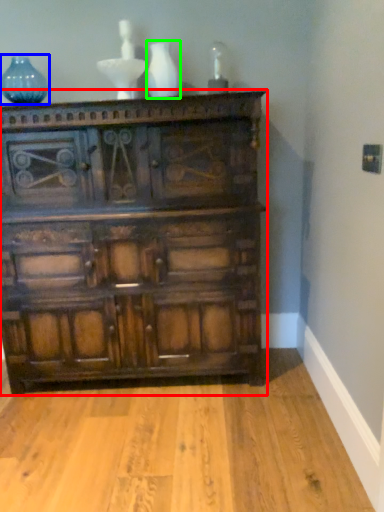
Question: Based on their relative distances, which object is nearer to chest of drawers (highlighted by a red box)? Choose from glass vase (highlighted by a blue box) and vase (highlighted by a green box).

Choices:
 (A) glass vase
 (B) vase

Answer: (B)